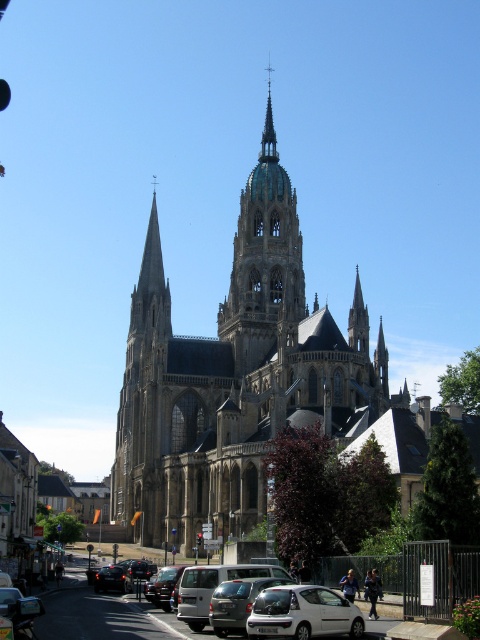
You are standing on the sidewalk in front of the cathedral and want to take a photo of the brown stone church at center and the metallic silver van at center. Which object should you position to your left side in the frame?

You should position the brown stone church at center to your left side in the frame because it is located to the left of the metallic silver van at center according to the description.

You are standing on the sidewalk in front of the cathedral and want to take a photo of the brown stone church at center and the metallic silver van at center. Which object should you focus on first to ensure it appears larger in your photo?

The brown stone church at center is further to the viewer than the metallic silver van at center, so focusing on it first will make it appear larger in the photo.